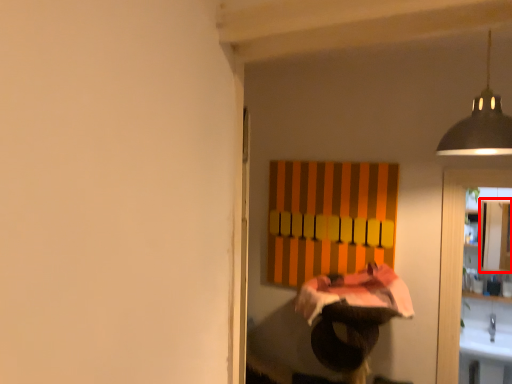
Question: From the image's perspective, where is cabinetry (annotated by the red box) located relative to lamp?

Choices:
 (A) above
 (B) below

Answer: (B)